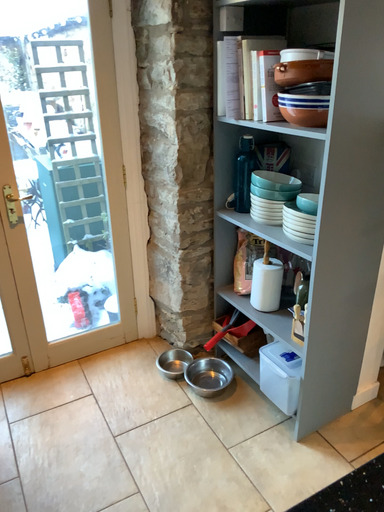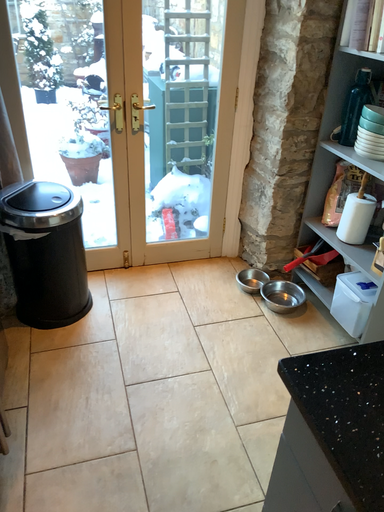
Question: Which way did the camera rotate in the video?

Choices:
 (A) rotated left
 (B) rotated right

Answer: (A)